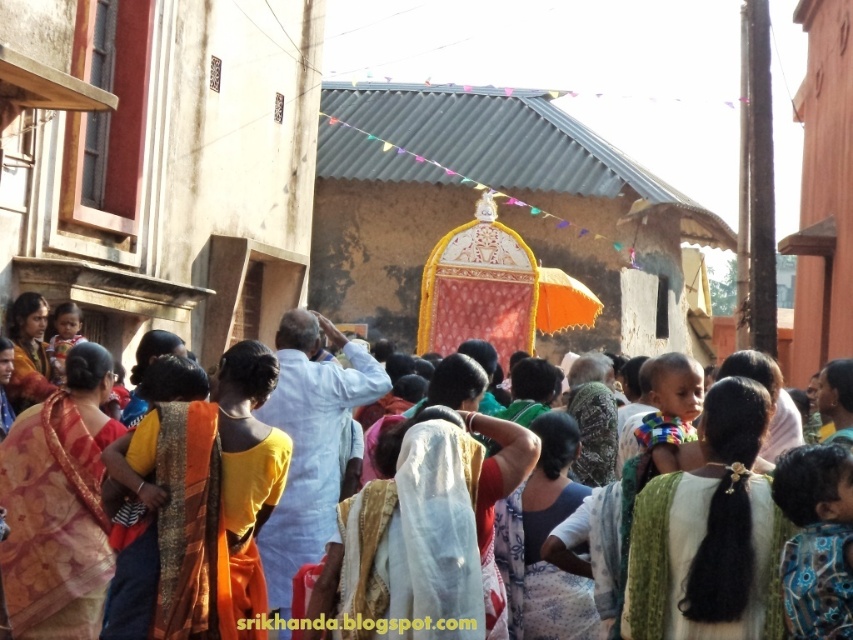
You are a photographer standing 10 meters away from the multicolored fabric at center and want to take a photo of the yellow fabric at center. Can you capture both fabrics in the same frame without moving? Please explain your reasoning using the given information.

The distance between the multicolored fabric at center and the yellow fabric at center is 16.86 meters. Since you are 10 meters away from the multicolored fabric at center, the yellow fabric at center would be 16.86 meters behind it. This means the yellow fabric at center is farther away from you than the multicolored fabric. Depending on your camera lens, if it has a wide enough angle or zoom capability, you might be able to capture both in the same frame without moving. However, if the lens doesntr allow,

You are a photographer trying to capture the palanquin in the center of the scene. You notice a specific point at coordinates point (302,330). What object is this point located on?

The point (302,330) is located on the matte orange cloth at center.

You are a photographer at the event and want to capture both the matte orange cloth at center and the white sheer saree at center in a single frame. Based on their heights, which one would appear taller in the photo?

The matte orange cloth at center appears taller in the photo because it has a greater height compared to the white sheer saree at center.